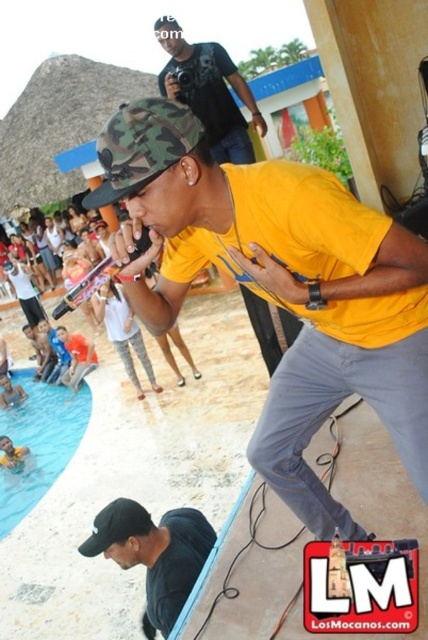
Does camo fabric hat at upper left have a greater height compared to blue smooth water at lower left?

Yes.

Does camo fabric hat at upper left have a lesser height compared to blue smooth water at lower left?

No, camo fabric hat at upper left is not shorter than blue smooth water at lower left.

Between point (255, 212) and point (35, 484), which one is positioned behind?

Point (35, 484)

Locate an element on the screen. Image resolution: width=428 pixels, height=640 pixels. camo fabric hat at upper left is located at coordinates (279, 285).

Can you confirm if camo fabric hat at upper left is taller than black matte cap at lower left?

Yes, camo fabric hat at upper left is taller than black matte cap at lower left.

You are a GUI agent. You are given a task and a screenshot of the screen. Output one action in this format:
    pyautogui.click(x=<x>, y=<y>)
    Task: Click on the camo fabric hat at upper left
    The image size is (428, 640).
    Given the screenshot: What is the action you would take?
    pyautogui.click(x=279, y=285)

Between point (371, 260) and point (145, 588), which one is positioned in front?

Point (371, 260) is in front.

Locate an element on the screen. camo fabric hat at upper left is located at coordinates (279, 285).

Does camo fabric hat at upper left have a greater width compared to matte black t-shirt at upper center?

Correct, the width of camo fabric hat at upper left exceeds that of matte black t-shirt at upper center.

Does camo fabric hat at upper left appear on the right side of matte black t-shirt at upper center?

Indeed, camo fabric hat at upper left is positioned on the right side of matte black t-shirt at upper center.

Is point (252, 252) less distant than point (228, 145)?

Yes.

Where is `camo fabric hat at upper left`? The height and width of the screenshot is (640, 428). camo fabric hat at upper left is located at coordinates (279, 285).